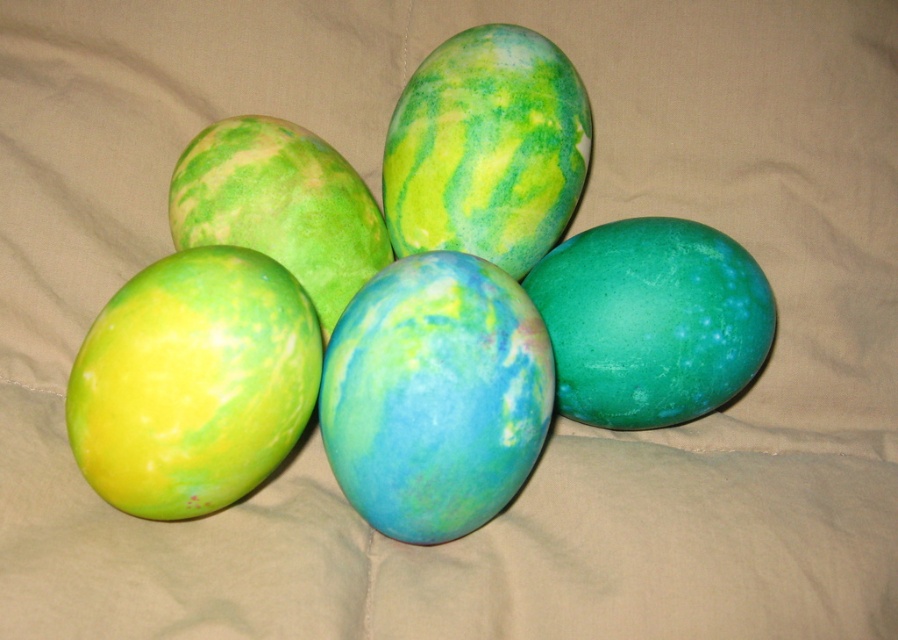
Question: Among these points, which one is farthest from the camera?

Choices:
 (A) (491, 24)
 (B) (491, 452)
 (C) (90, 330)

Answer: (A)

Question: Is blue-green marble egg at center positioned behind green matte egg at center?

Choices:
 (A) yes
 (B) no

Answer: (B)

Question: Considering the relative positions of green matte egg at center and green marbled egg at center in the image provided, where is green matte egg at center located with respect to green marbled egg at center?

Choices:
 (A) above
 (B) below

Answer: (B)

Question: Which point is farther to the camera?

Choices:
 (A) (693, 364)
 (B) (495, 232)
 (C) (245, 305)
 (D) (198, 396)

Answer: (B)

Question: Is green matte egg at center below green marbled egg at center?

Choices:
 (A) no
 (B) yes

Answer: (B)

Question: Among these objects, which one is nearest to the camera?

Choices:
 (A) green marbled egg at center
 (B) yellow-green marble egg at lower left
 (C) blue-green marble egg at center
 (D) green matte egg at center

Answer: (B)